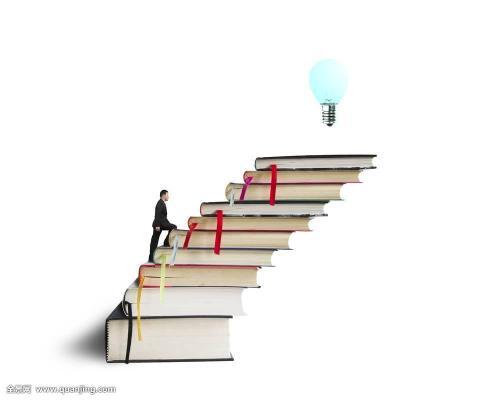
You are a GUI agent. You are given a task and a screenshot of the screen. Output one action in this format:
    pyautogui.click(x=<x>, y=<y>)
    Task: Click on the horizontally stacked "piled" book
    The image size is (500, 400).
    Given the screenshot: What is the action you would take?
    pyautogui.click(x=316, y=160), pyautogui.click(x=307, y=176), pyautogui.click(x=300, y=191), pyautogui.click(x=275, y=208), pyautogui.click(x=264, y=221), pyautogui.click(x=253, y=240), pyautogui.click(x=235, y=254), pyautogui.click(x=224, y=275), pyautogui.click(x=201, y=295), pyautogui.click(x=192, y=336)